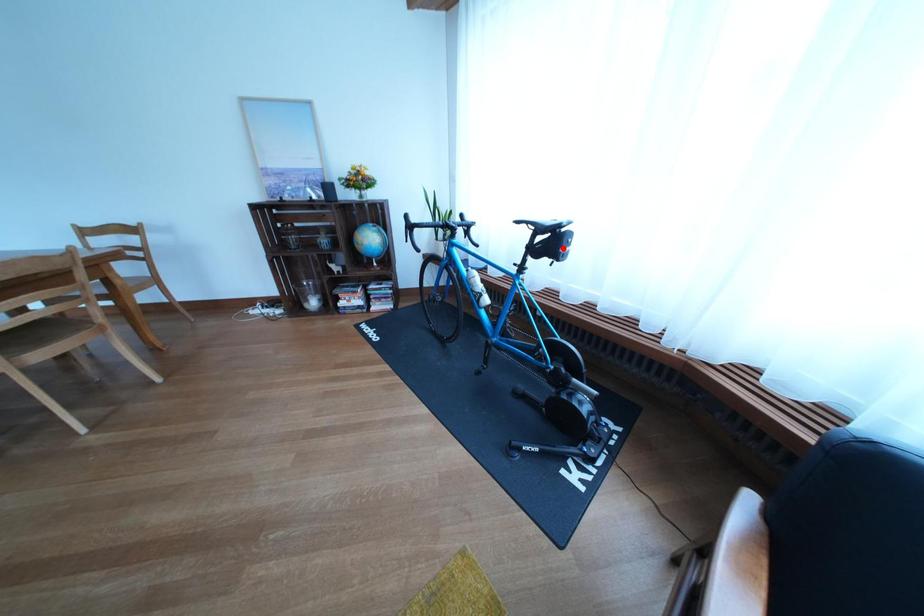
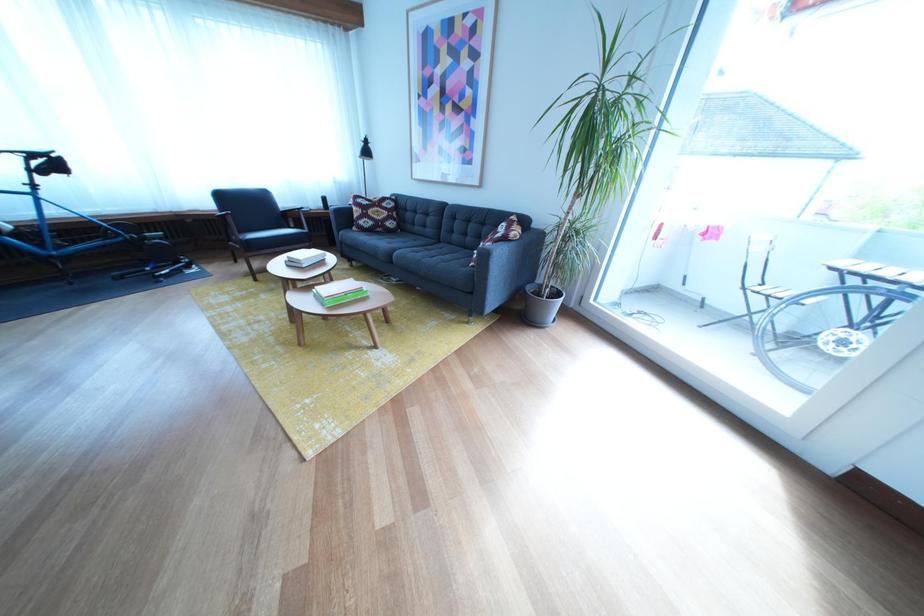
Find the pixel in the second image that matches the highlighted location in the first image.

(64, 169)